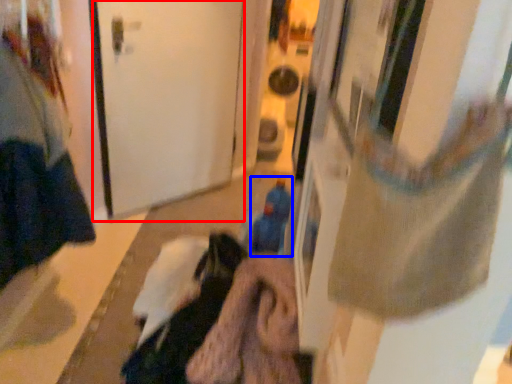
Question: Which of the following is the farthest to the observer, door (highlighted by a red box) or toy (highlighted by a blue box)?

Choices:
 (A) door
 (B) toy

Answer: (A)